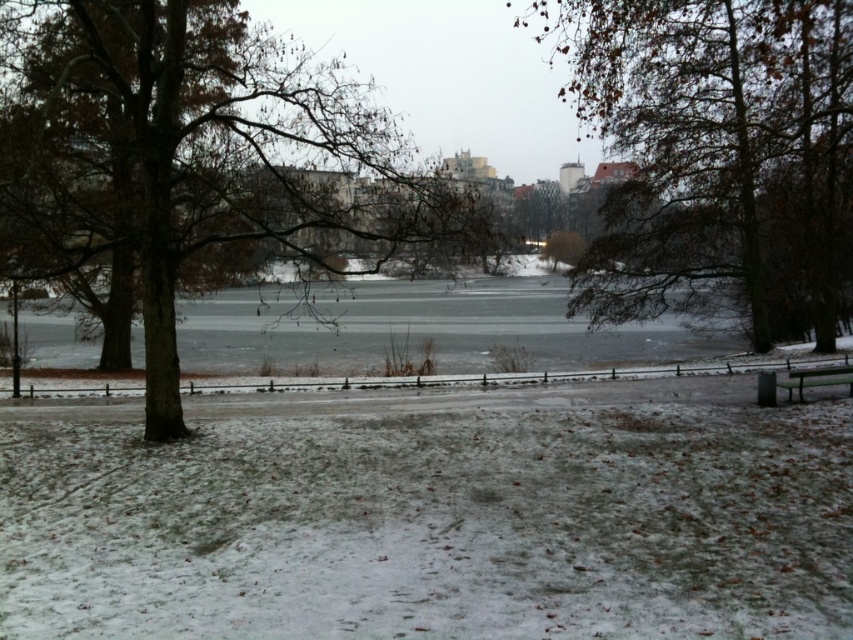
You are a park visitor standing at the wooden bench at lower right. You want to walk to the brown leafy tree at center. Which direction should you move relative to the bench?

The brown leafy tree at center is positioned on the right side of the wooden bench at lower right, so you should move to the right relative to the bench to reach it.